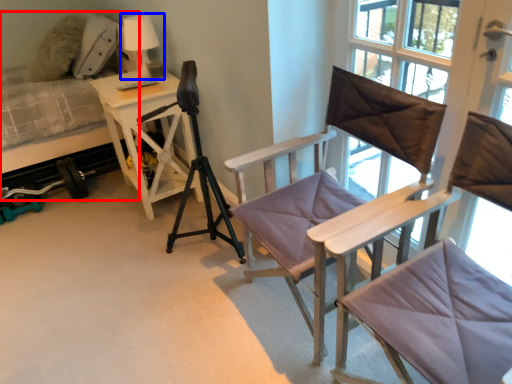
Question: Which point is further to the camera, hospital bed (highlighted by a red box) or table lamp (highlighted by a blue box)?

Choices:
 (A) hospital bed
 (B) table lamp

Answer: (B)